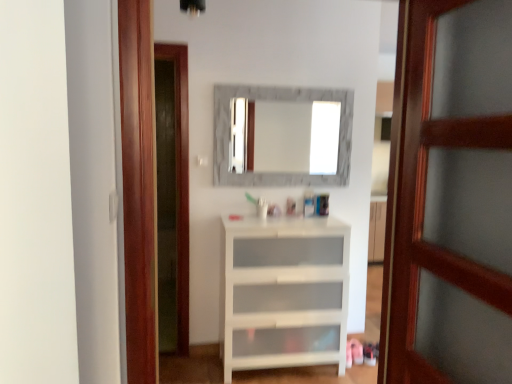
Locate an element on the screen. Image resolution: width=512 pixels, height=384 pixels. white glossy cabinet at center is located at coordinates (283, 293).

From a real-world perspective, is marble frame mirror at center on top of wooden door at right?

Yes, from a real-world perspective, marble frame mirror at center is over wooden door at right

What's the angular difference between marble frame mirror at center and wooden door at right's facing directions?

marble frame mirror at center and wooden door at right are facing 90.8 degrees away from each other.

At what (x,y) coordinates should I click in order to perform the action: click on door lying below the marble frame mirror at center (from the image's perspective). Please return your answer as a coordinate pair (x, y). Image resolution: width=512 pixels, height=384 pixels. Looking at the image, I should click on (450, 197).

Is marble frame mirror at center oriented away from wooden door at right?

No.

Is white glossy cabinet at center aimed at white glossy cabinet at center?

No, white glossy cabinet at center is not facing towards white glossy cabinet at center.

Considering the positions of objects white glossy cabinet at center and white glossy cabinet at center in the image provided, who is behind, white glossy cabinet at center or white glossy cabinet at center?

white glossy cabinet at center is more distant.

How many degrees apart are the facing directions of white glossy cabinet at center and white glossy cabinet at center?

They differ by 1.83 degrees in their facing directions.

From the image's perspective, does white glossy cabinet at center appear lower than white glossy cabinet at center?

Indeed, from the image's perspective, white glossy cabinet at center is shown beneath white glossy cabinet at center.

Is white glossy cabinet at center to the right of wooden door at right from the viewer's perspective?

Incorrect, white glossy cabinet at center is not on the right side of wooden door at right.

There is a white glossy cabinet at center. Where is `door above it (from a real-world perspective)`? This screenshot has height=384, width=512. door above it (from a real-world perspective) is located at coordinates (450, 197).

Is white glossy cabinet at center positioned with its back to wooden door at right?

No.

Between white glossy cabinet at center and wooden door at right, which one is positioned in front?

wooden door at right.

Consider the image. How much distance is there between wooden door at right and marble frame mirror at center?

The distance of wooden door at right from marble frame mirror at center is 3.06 meters.

From a real-world perspective, is wooden door at right on marble frame mirror at center?

No, from a real-world perspective, wooden door at right is not on top of marble frame mirror at center.

The width and height of the screenshot is (512, 384). Find the location of `mirror behind the wooden door at right`. mirror behind the wooden door at right is located at coordinates (297, 136).

From the image's perspective, which object appears higher, wooden door at right or marble frame mirror at center?

marble frame mirror at center appears higher in the image.

How far apart are white glossy cabinet at center and marble frame mirror at center?

white glossy cabinet at center is 37.61 inches from marble frame mirror at center.

Does white glossy cabinet at center appear on the left side of marble frame mirror at center?

In fact, white glossy cabinet at center is to the right of marble frame mirror at center.

This screenshot has height=384, width=512. In order to click on cabinetry on the right of marble frame mirror at center in this screenshot , I will do pyautogui.click(x=377, y=231).

Which object is wider, white glossy cabinet at center or marble frame mirror at center?

With larger width is white glossy cabinet at center.

From the image's perspective, would you say marble frame mirror at center is positioned over white glossy cabinet at center?

Indeed, from the image's perspective, marble frame mirror at center is shown above white glossy cabinet at center.

Is marble frame mirror at center turned away from white glossy cabinet at center?

No, marble frame mirror at center is not facing the opposite direction of white glossy cabinet at center.

Considering the sizes of objects marble frame mirror at center and white glossy cabinet at center in the image provided, who is wider, marble frame mirror at center or white glossy cabinet at center?

white glossy cabinet at center is wider.

Between point (232, 133) and point (242, 355), which one is positioned behind?

Point (232, 133)

From a real-world perspective, is white glossy cabinet at center located beneath white glossy cabinet at center?

Yes, from a real-world perspective, white glossy cabinet at center is under white glossy cabinet at center.

Which object is positioned more to the right, white glossy cabinet at center or white glossy cabinet at center?

From the viewer's perspective, white glossy cabinet at center appears more on the right side.

Is white glossy cabinet at center facing towards white glossy cabinet at center?

No.

You are a GUI agent. You are given a task and a screenshot of the screen. Output one action in this format:
    pyautogui.click(x=<x>, y=<y>)
    Task: Click on the door in front of the marble frame mirror at center
    
    Given the screenshot: What is the action you would take?
    pos(450,197)

Find the location of a particular element. The image size is (512, 384). shelf below the white glossy cabinet at center (from the image's perspective) is located at coordinates (283, 293).

When comparing their distances from white glossy cabinet at center, does marble frame mirror at center or wooden door at right seem further?

marble frame mirror at center is further to white glossy cabinet at center.

From the picture: From the image, which object appears to be nearer to marble frame mirror at center, white glossy cabinet at center or white glossy cabinet at center?

white glossy cabinet at center is closer to marble frame mirror at center.

Consider the image. When comparing their distances from marble frame mirror at center, does white glossy cabinet at center or wooden door at right seem further?

wooden door at right.

Based on their spatial positions, is white glossy cabinet at center or marble frame mirror at center further from wooden door at right?

Among the two, marble frame mirror at center is located further to wooden door at right.

From the image, which object appears to be farther from white glossy cabinet at center, wooden door at right or marble frame mirror at center?

wooden door at right is positioned further to the anchor white glossy cabinet at center.

Which object lies nearer to the anchor point marble frame mirror at center, white glossy cabinet at center or wooden door at right?

white glossy cabinet at center is positioned closer to the anchor marble frame mirror at center.

Based on their spatial positions, is white glossy cabinet at center or white glossy cabinet at center closer to wooden door at right?

Based on the image, white glossy cabinet at center appears to be nearer to wooden door at right.

Considering their positions, is wooden door at right positioned further to white glossy cabinet at center than white glossy cabinet at center?

The object further to white glossy cabinet at center is wooden door at right.

The width and height of the screenshot is (512, 384). I want to click on mirror between white glossy cabinet at center and white glossy cabinet at center along the z-axis, so click(x=297, y=136).

Image resolution: width=512 pixels, height=384 pixels. Identify the location of shelf located between wooden door at right and white glossy cabinet at center in the depth direction. (283, 293).

Locate an element on the screen. This screenshot has width=512, height=384. mirror located between wooden door at right and white glossy cabinet at center in the depth direction is located at coordinates (297, 136).

Find the location of a particular element. The image size is (512, 384). shelf between wooden door at right and marble frame mirror at center along the z-axis is located at coordinates click(x=283, y=293).